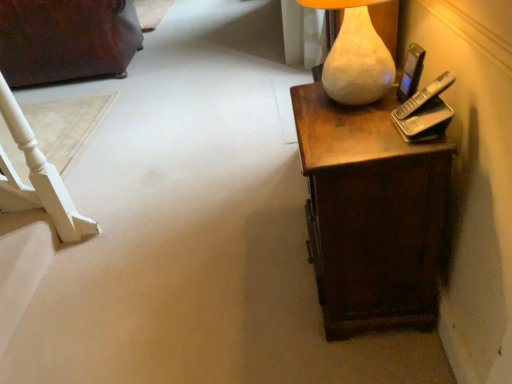
Where is `vacant space underneath matte white lamp at upper right (from a real-world perspective)`? The image size is (512, 384). vacant space underneath matte white lamp at upper right (from a real-world perspective) is located at coordinates (339, 104).